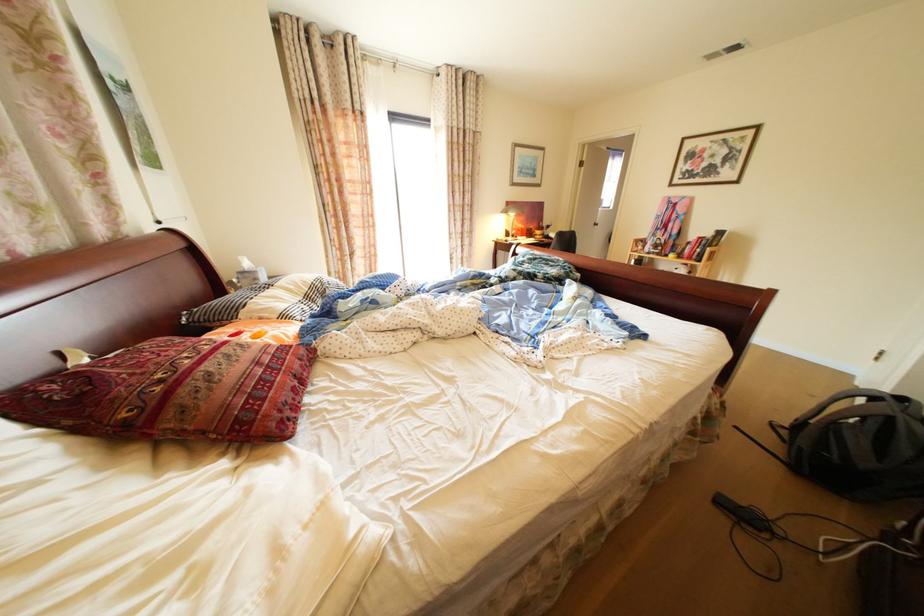
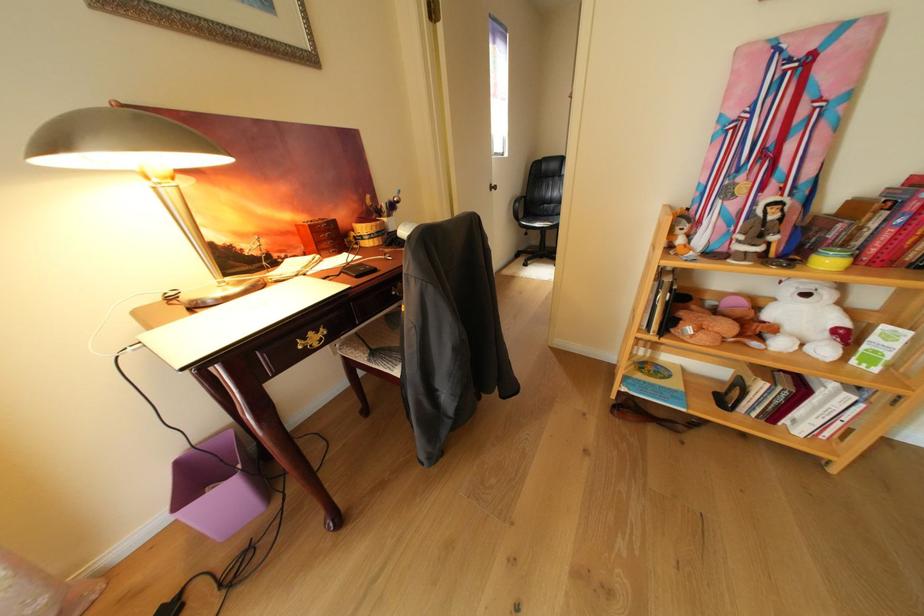
Find the pixel in the second image that matches point 689,270 in the first image.

(820, 297)